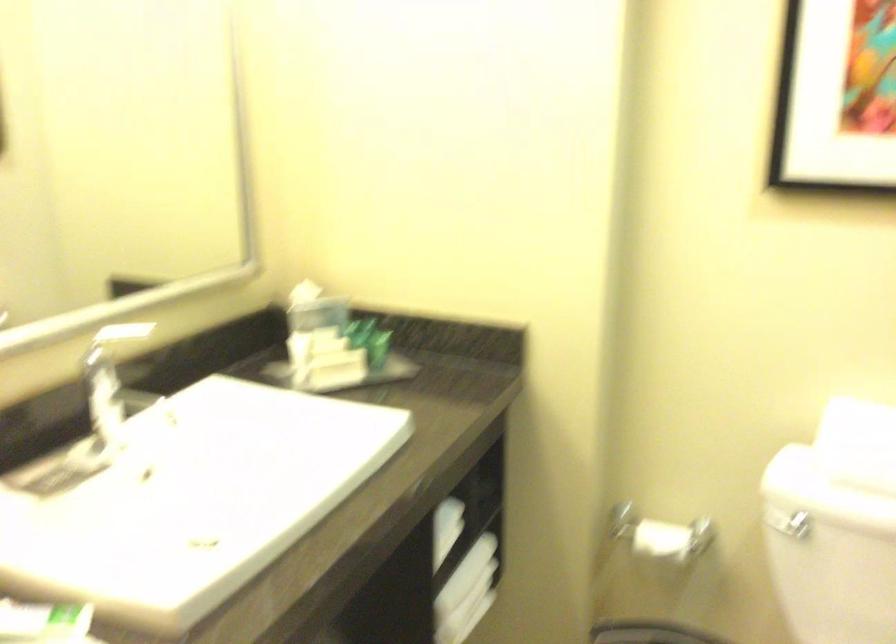
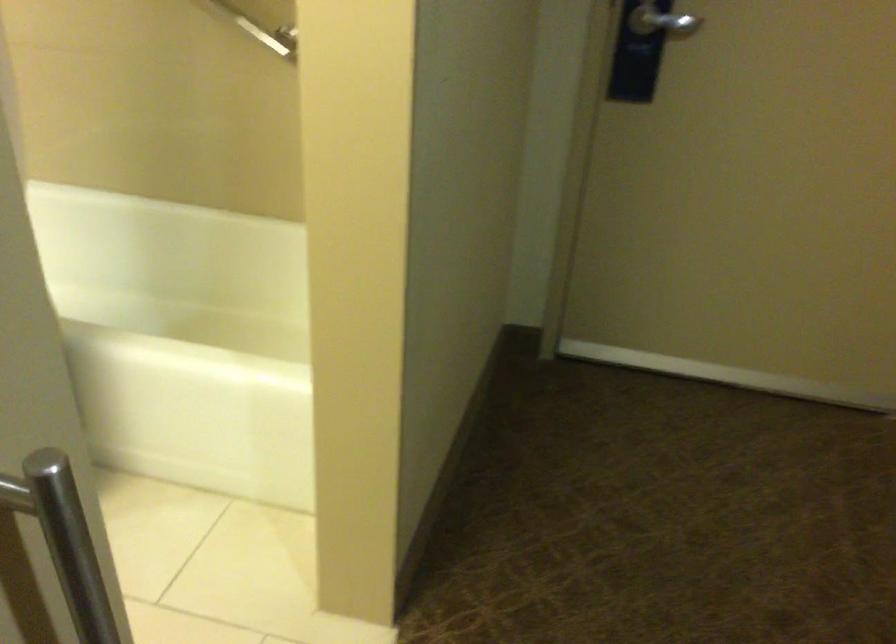
The first image is from the beginning of the video and the second image is from the end. How did the camera likely rotate when shooting the video?

The rotation direction of the camera is right-down.